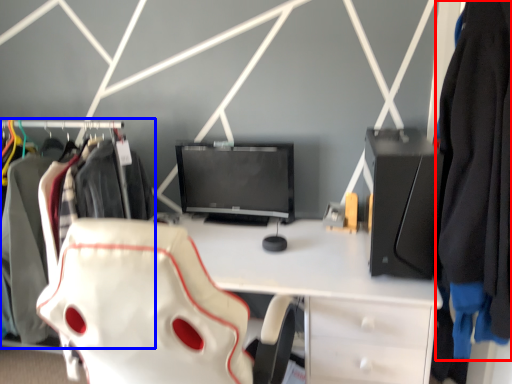
Question: Among these objects, which one is nearest to the camera, clothing (highlighted by a red box) or closet (highlighted by a blue box)?

Choices:
 (A) clothing
 (B) closet

Answer: (A)